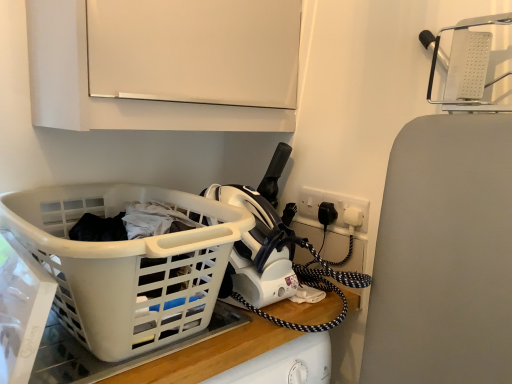
Question: Is white plastic laundry basket at lower left outside of white matte cabinet at upper center?

Choices:
 (A) yes
 (B) no

Answer: (A)

Question: Is white plastic laundry basket at lower left far away from white matte cabinet at upper center?

Choices:
 (A) no
 (B) yes

Answer: (A)

Question: Is white plastic laundry basket at lower left shorter than white matte cabinet at upper center?

Choices:
 (A) no
 (B) yes

Answer: (B)

Question: From the image's perspective, is white plastic laundry basket at lower left on top of white matte cabinet at upper center?

Choices:
 (A) yes
 (B) no

Answer: (B)

Question: From the image's perspective, would you say white plastic laundry basket at lower left is shown under white matte cabinet at upper center?

Choices:
 (A) yes
 (B) no

Answer: (A)

Question: From a real-world perspective, is white plastic laundry basket at lower left physically above white matte cabinet at upper center?

Choices:
 (A) yes
 (B) no

Answer: (B)

Question: Does white plastic socket at upper right appear on the left side of white plastic laundry basket at lower left?

Choices:
 (A) no
 (B) yes

Answer: (A)

Question: Does white plastic socket at upper right have a lesser height compared to white plastic laundry basket at lower left?

Choices:
 (A) no
 (B) yes

Answer: (B)

Question: Is white plastic socket at upper right facing away from white plastic laundry basket at lower left?

Choices:
 (A) no
 (B) yes

Answer: (A)

Question: Does white plastic socket at upper right come in front of white plastic laundry basket at lower left?

Choices:
 (A) no
 (B) yes

Answer: (A)

Question: Is white plastic socket at upper right to the right of white plastic laundry basket at lower left from the viewer's perspective?

Choices:
 (A) yes
 (B) no

Answer: (A)

Question: Is white plastic socket at upper right aimed at white plastic laundry basket at lower left?

Choices:
 (A) no
 (B) yes

Answer: (B)

Question: Can you confirm if white matte cabinet at upper center is smaller than white plastic socket at upper right?

Choices:
 (A) yes
 (B) no

Answer: (B)